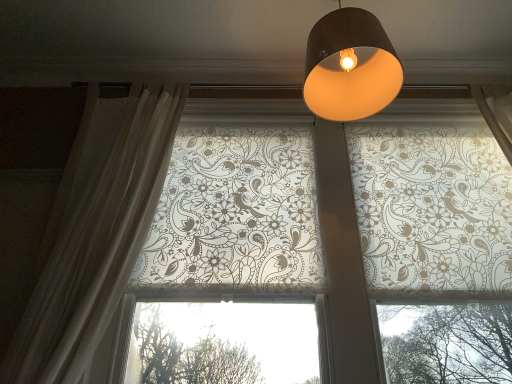
Question: Could you tell me if matte black lampshade at upper center is turned towards translucent floral-patterned roller blinds at upper center?

Choices:
 (A) no
 (B) yes

Answer: (A)

Question: Is translucent floral-patterned roller blinds at upper center a part of matte black lampshade at upper center?

Choices:
 (A) yes
 (B) no

Answer: (B)

Question: Considering the relative positions of matte black lampshade at upper center and translucent floral-patterned roller blinds at upper center in the image provided, is matte black lampshade at upper center in front of translucent floral-patterned roller blinds at upper center?

Choices:
 (A) no
 (B) yes

Answer: (B)

Question: Does matte black lampshade at upper center lie behind translucent floral-patterned roller blinds at upper center?

Choices:
 (A) yes
 (B) no

Answer: (B)

Question: Are matte black lampshade at upper center and translucent floral-patterned roller blinds at upper center located far from each other?

Choices:
 (A) yes
 (B) no

Answer: (B)

Question: Can you confirm if matte black lampshade at upper center is taller than translucent floral-patterned roller blinds at upper center?

Choices:
 (A) yes
 (B) no

Answer: (B)

Question: From a real-world perspective, is sheer white curtain at left beneath matte black lampshade at upper center?

Choices:
 (A) yes
 (B) no

Answer: (A)

Question: Is sheer white curtain at left looking in the opposite direction of matte black lampshade at upper center?

Choices:
 (A) no
 (B) yes

Answer: (A)

Question: Does sheer white curtain at left have a larger size compared to matte black lampshade at upper center?

Choices:
 (A) no
 (B) yes

Answer: (B)

Question: From the image's perspective, is sheer white curtain at left beneath matte black lampshade at upper center?

Choices:
 (A) no
 (B) yes

Answer: (B)

Question: Is sheer white curtain at left facing towards matte black lampshade at upper center?

Choices:
 (A) yes
 (B) no

Answer: (B)

Question: Considering the relative sizes of sheer white curtain at left and matte black lampshade at upper center in the image provided, is sheer white curtain at left smaller than matte black lampshade at upper center?

Choices:
 (A) no
 (B) yes

Answer: (A)

Question: Does matte black lampshade at upper center have a greater height compared to sheer white curtain at left?

Choices:
 (A) yes
 (B) no

Answer: (B)